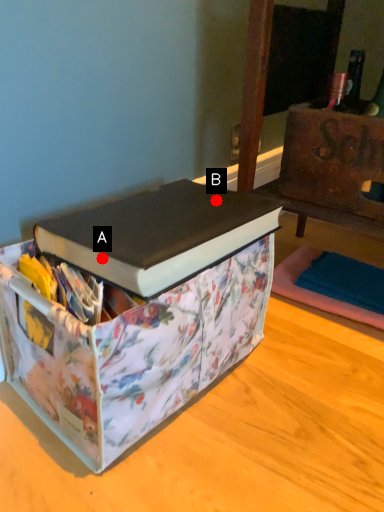
Question: Two points are circled on the image, labeled by A and B beside each circle. Among these points, which one is nearest to the camera?

Choices:
 (A) A is closer
 (B) B is closer

Answer: (A)